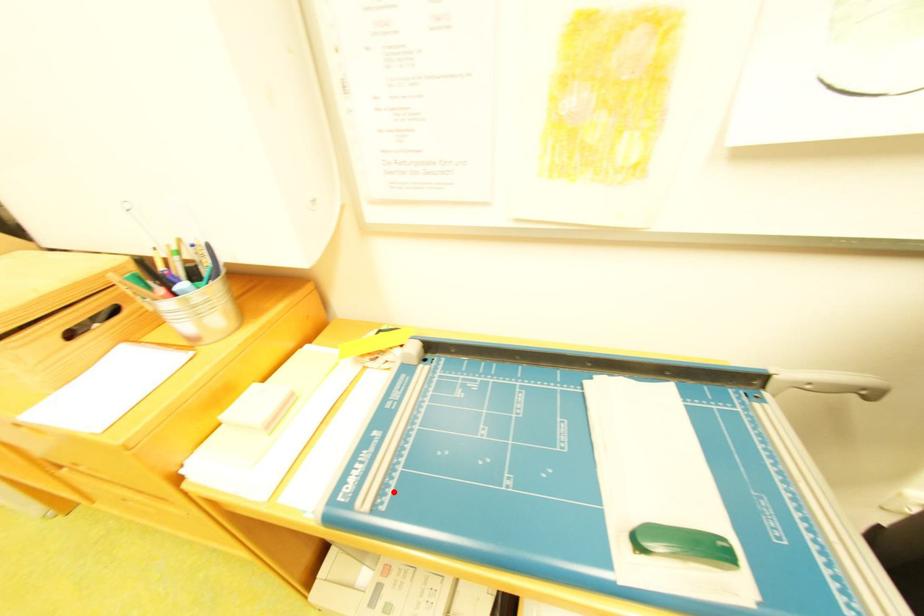
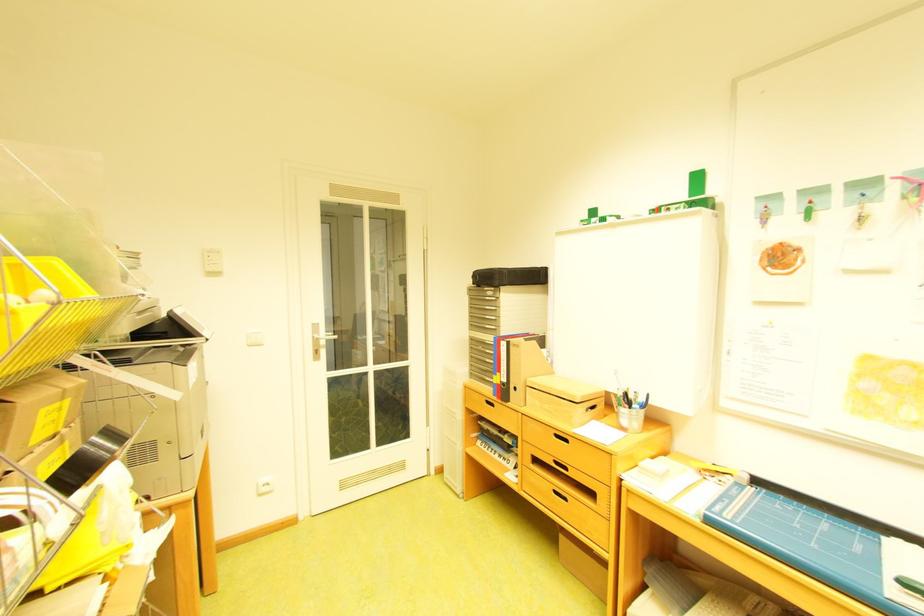
Find the pixel in the second image that matches the highlighted location in the first image.

(747, 517)